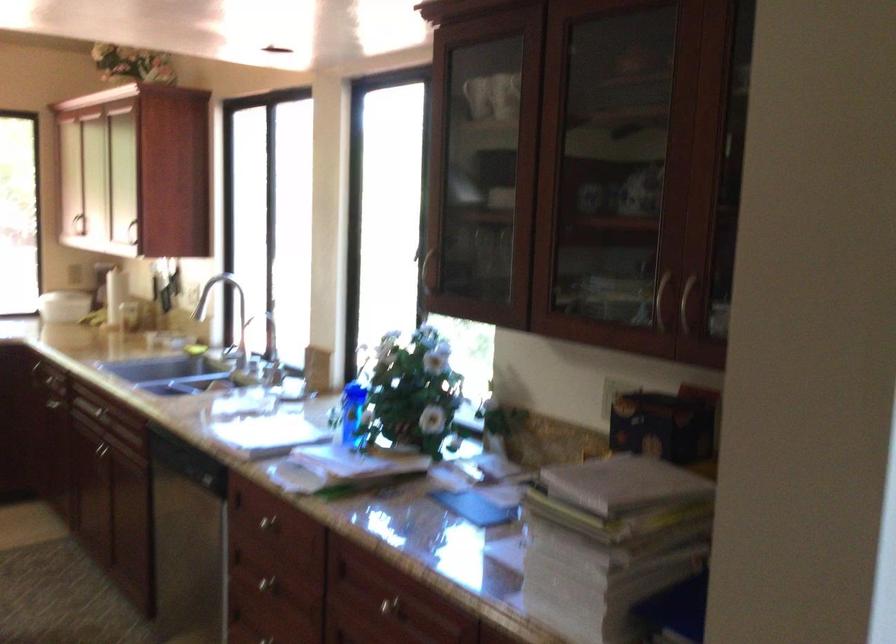
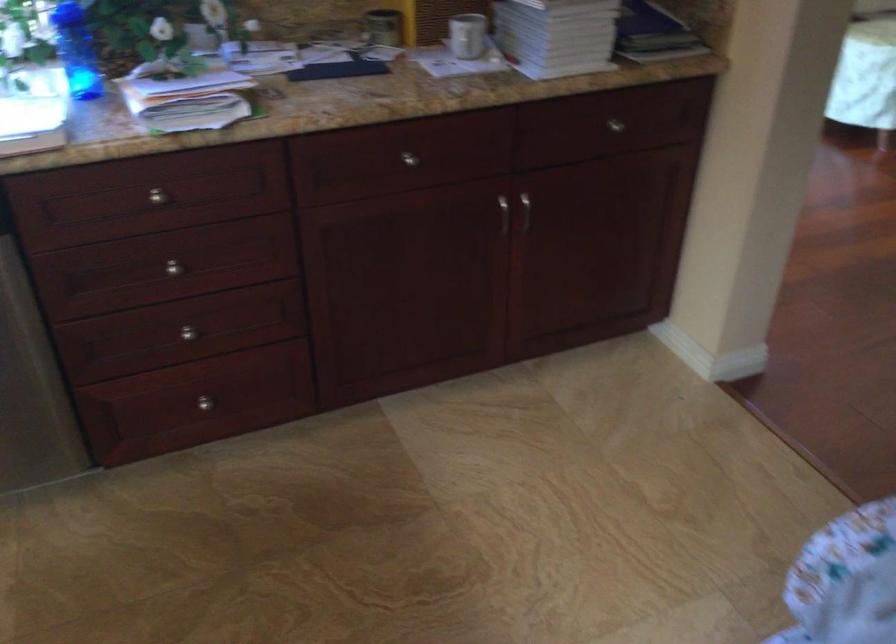
The point at (540, 529) is marked in the first image. Where is the corresponding point in the second image?

(467, 35)